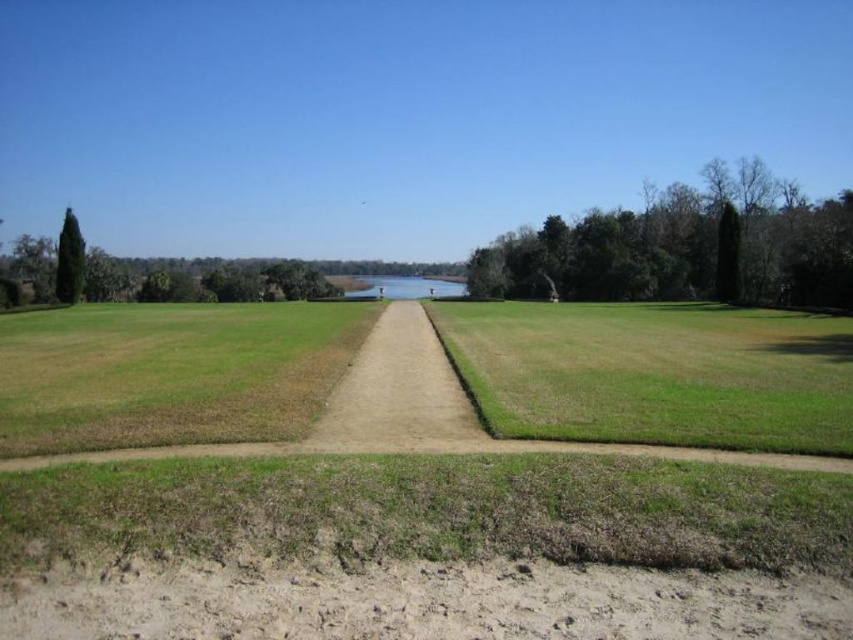
You are a gardener who needs to water two areas of green grass. The green grass at center and the green grass at right are both in need of attention. Given that your watering hose can reach up to 12 meters, will you be able to water both areas from your current position without moving the hose? Please explain your reasoning.

The green grass at center is 11.87 meters from the green grass at right. Since the distance between them is less than the 12 meter reach of the hose, you can water both areas without moving the hose as long as they are within the hose range from your position.

You are standing at the starting point of the dirt path in the central grass fields. You see two points marked on the map as point 1 at coordinates point (x=498, y=588) and point 2 at coordinates point (x=746, y=348). Which point is closer to you when facing the direction of the dirt path?

Point (x=498, y=588) is in front of point (x=746, y=348), so when facing the direction of the dirt path, point (x=498, y=588) is closer to you.